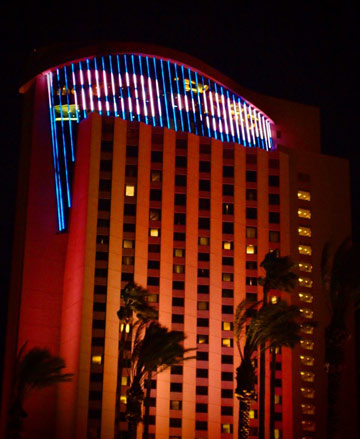
Where is `apartments with lights on`? apartments with lights on is located at coordinates (228, 341), (228, 327), (229, 247), (152, 233), (130, 189), (127, 245), (95, 358).